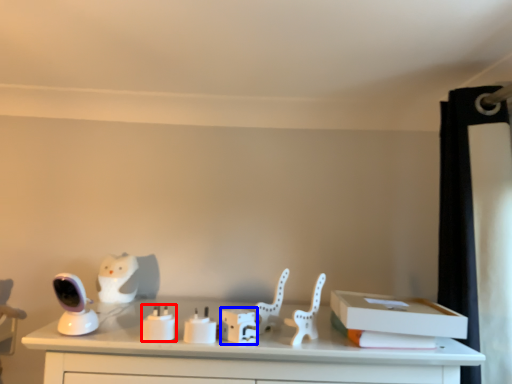
Question: Among these objects, which one is nearest to the camera, candle holder (highlighted by a red box) or box (highlighted by a blue box)?

Choices:
 (A) candle holder
 (B) box

Answer: (A)